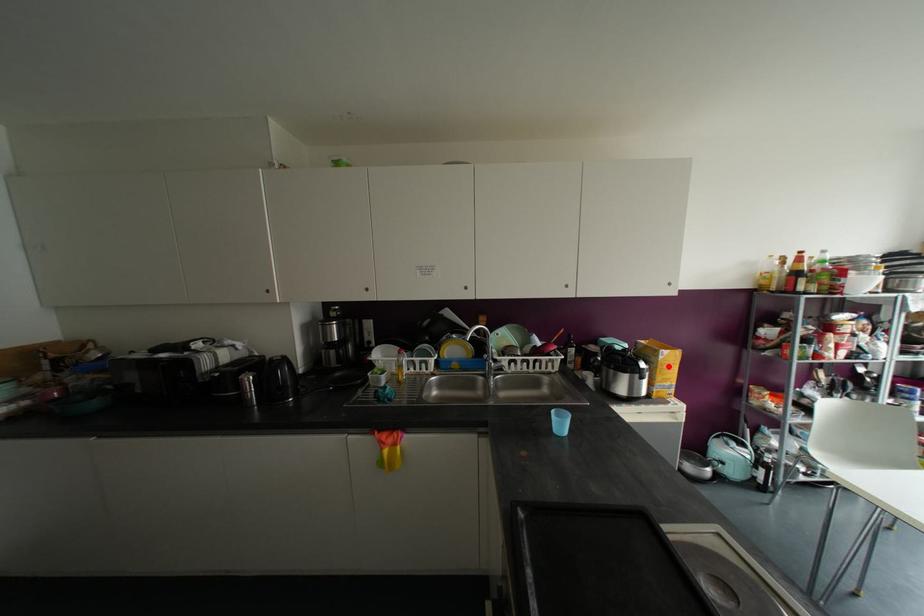
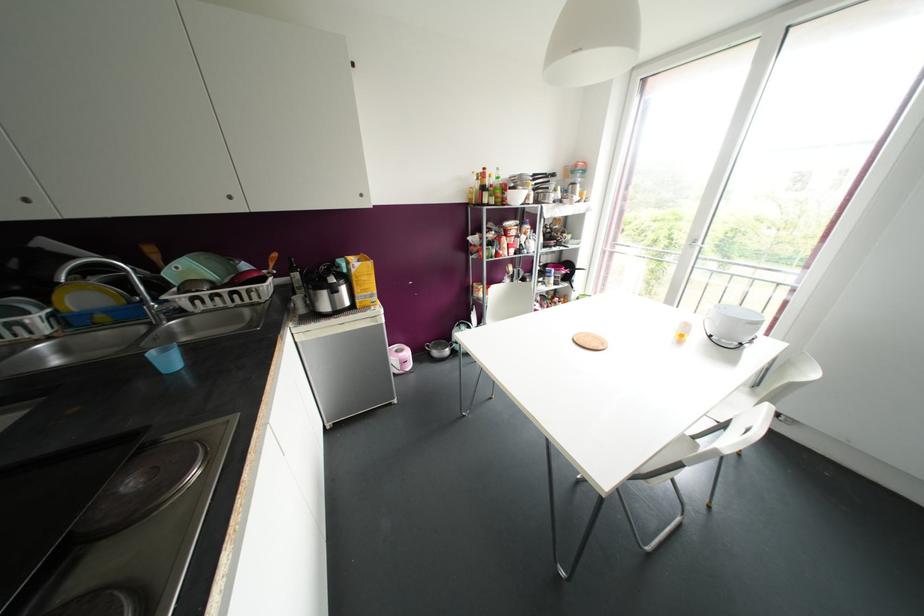
Question: I am providing you with two images of the same scene from different viewpoints. A red point is shown in image1. For the corresponding object point in image2, is it positioned nearer or farther from the camera?

Choices:
 (A) Nearer
 (B) Farther

Answer: (A)